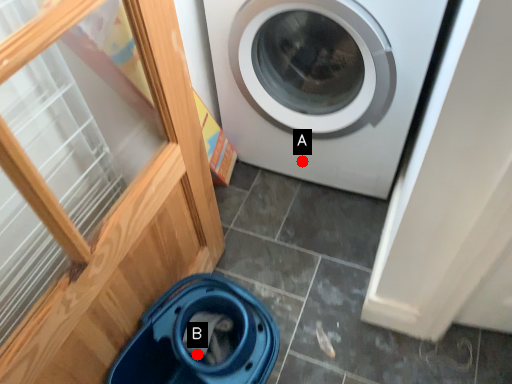
Question: Two points are circled on the image, labeled by A and B beside each circle. Which point is closer to the camera?

Choices:
 (A) A is closer
 (B) B is closer

Answer: (B)